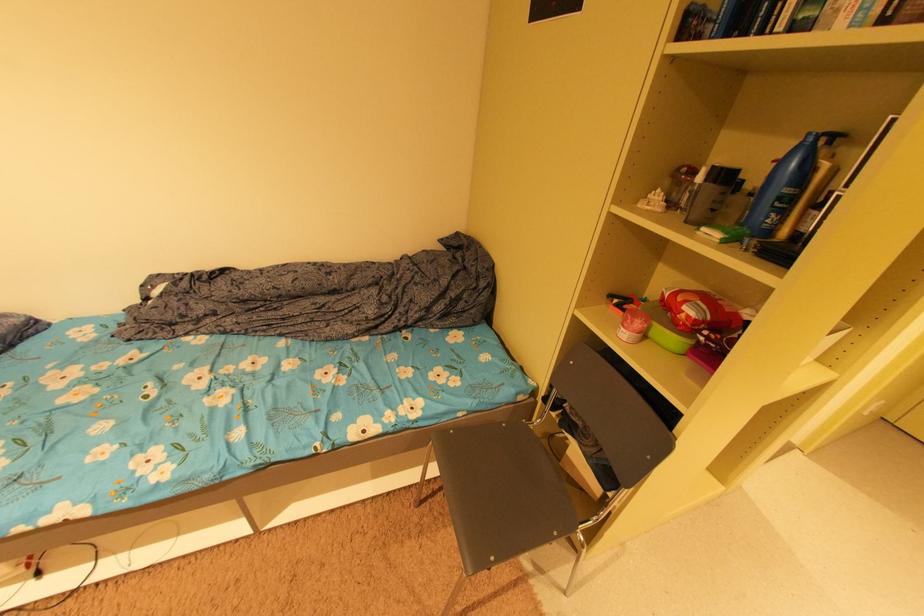
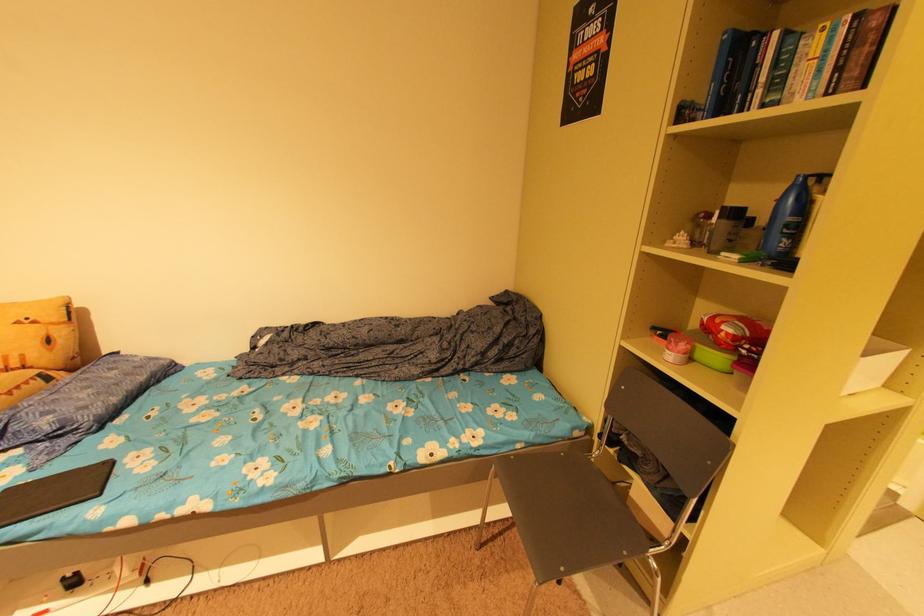
The point at (x=794, y=191) is marked in the first image. Where is the corresponding point in the second image?

(797, 220)